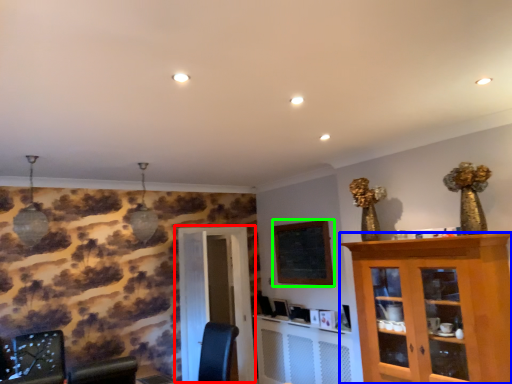
Question: Considering the real-world distances, which object is farthest from door (highlighted by a red box)? cabinetry (highlighted by a blue box) or bulletin board (highlighted by a green box)?

Choices:
 (A) cabinetry
 (B) bulletin board

Answer: (A)